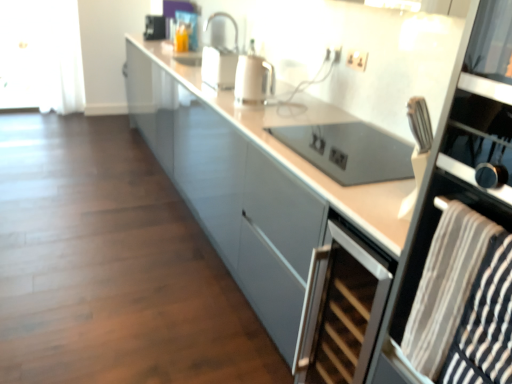
Question: Visually, is black glass oven at right positioned to the left or to the right of metallic silver toaster at upper center, the first appliance in the left-to-right sequence?

Choices:
 (A) left
 (B) right

Answer: (B)

Question: Would you say black glass oven at right is inside or outside metallic silver toaster at upper center, which is the 1th appliance from top to bottom?

Choices:
 (A) inside
 (B) outside

Answer: (B)

Question: Based on their relative distances, which object is nearer to the white glossy kettle at center?

Choices:
 (A) white glossy cabinet at center
 (B) metallic silver toaster at upper center, marked as the 1th appliance in a back-to-front arrangement
 (C) white plastic electric outlet at upper center, marked as the first electric outlet in a back-to-front arrangement
 (D) striped fabric towel at right
 (E) silver metallic wine cooler at lower right

Answer: (C)

Question: Which is farther from the white sheer curtain at left?

Choices:
 (A) satin silver oven at center, the 2th appliance when ordered from left to right
 (B) white plastic electric outlet at upper center, marked as the first electric outlet in a back-to-front arrangement
 (C) striped fabric towel at right
 (D) black glass oven at right
 (E) white glossy cabinet at center

Answer: (C)